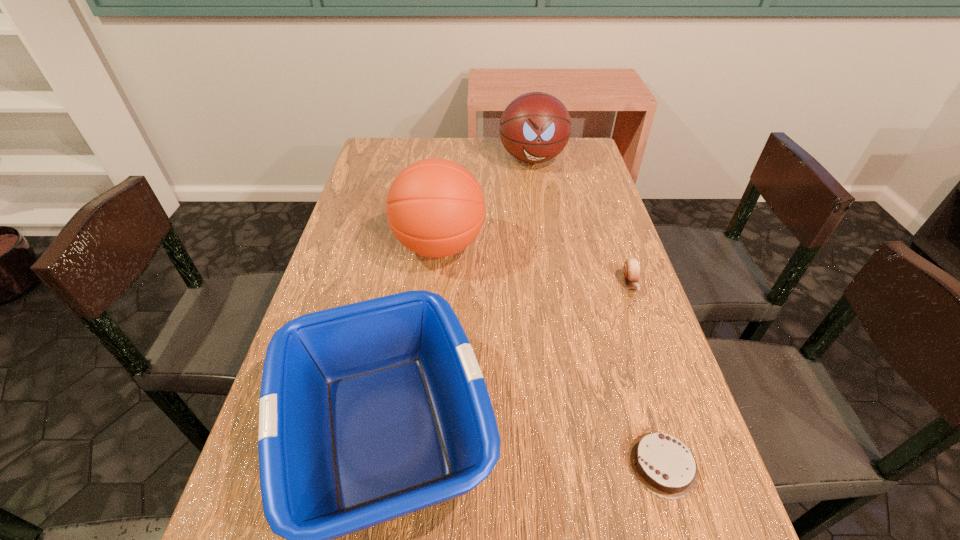
The image size is (960, 540). What are the coordinates of `the nearer basketball` in the screenshot? It's located at (435, 207).

I want to click on the farthest object, so click(x=535, y=127).

Identify the location of the farther basketball. (535, 127).

The image size is (960, 540). I want to click on escargot, so click(631, 268).

This screenshot has height=540, width=960. In order to click on chocolate cake in this screenshot , I will do `click(662, 464)`.

Where is `vacant space situated 0.240m on the back of the nearer basketball`? This screenshot has width=960, height=540. vacant space situated 0.240m on the back of the nearer basketball is located at coordinates (446, 174).

Where is `vacant space located 0.320m on the front of the farther basketball`? This screenshot has height=540, width=960. vacant space located 0.320m on the front of the farther basketball is located at coordinates (546, 240).

This screenshot has height=540, width=960. What are the coordinates of `vacant space located 0.270m on the front-facing side of the fourth tallest object` in the screenshot? It's located at click(x=672, y=403).

Image resolution: width=960 pixels, height=540 pixels. I want to click on free spot located on the left of the chocolate cake, so click(506, 464).

I want to click on object present at the far edge, so click(535, 127).